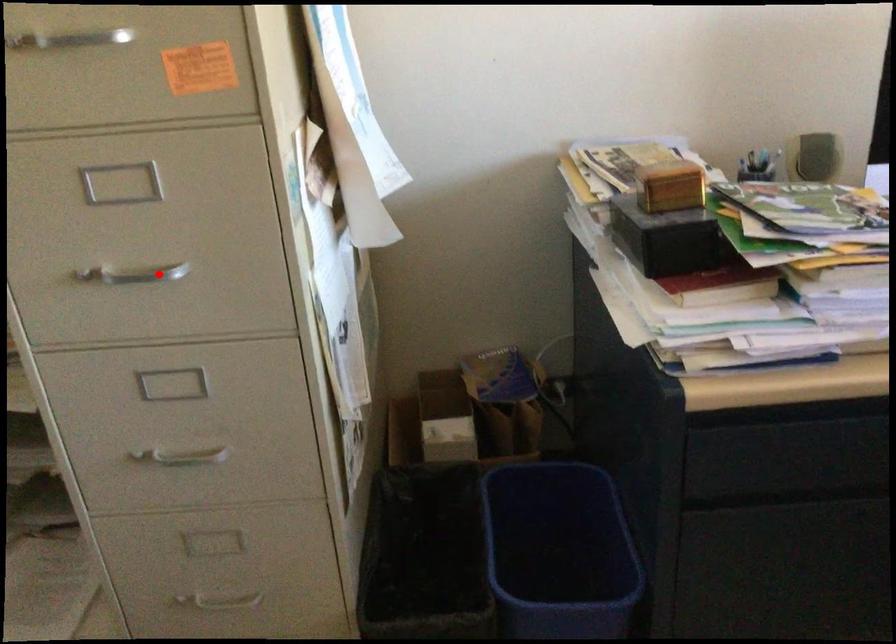
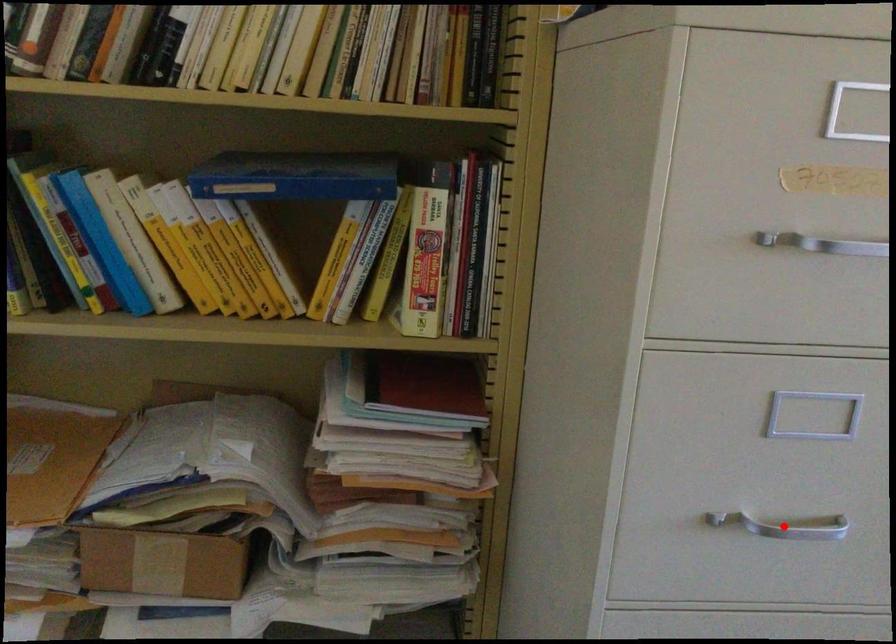
I am providing you with two images of the same scene from different viewpoints. A red point is marked on the first image and another point is marked on the second image. Are the points marked in image1 and image2 representing the same 3D position?

Yes